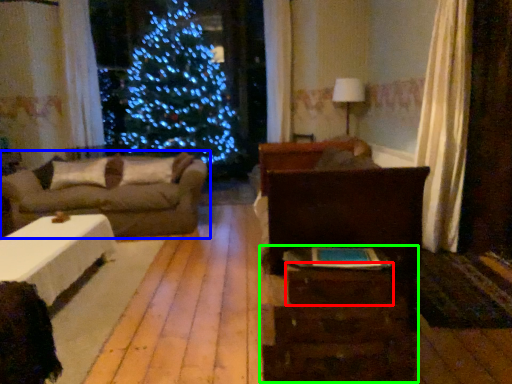
Question: Estimate the real-world distances between objects in this image. Which object is closer to drawer (highlighted by a red box), studio couch (highlighted by a blue box) or dresser (highlighted by a green box)?

Choices:
 (A) studio couch
 (B) dresser

Answer: (B)